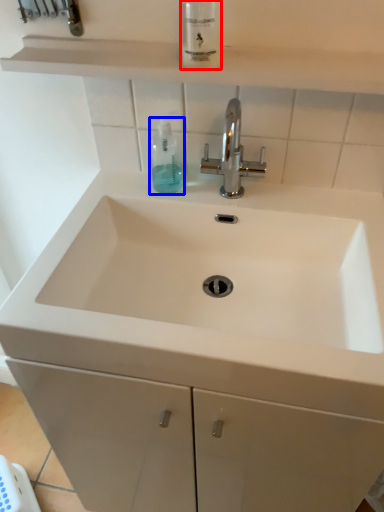
Question: Among these objects, which one is farthest to the camera, mouthwash (highlighted by a red box) or mouthwash (highlighted by a blue box)?

Choices:
 (A) mouthwash
 (B) mouthwash

Answer: (B)